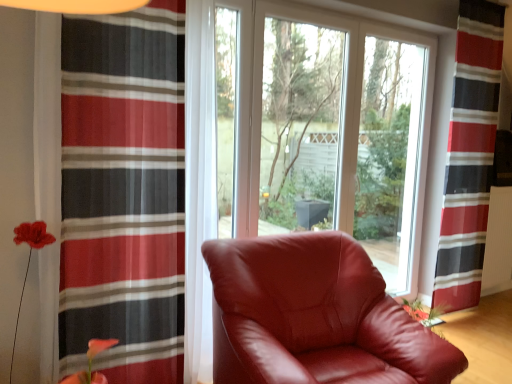
Question: Can you confirm if satin burgundy armchair at center is bigger than transparent glass window at center?

Choices:
 (A) no
 (B) yes

Answer: (B)

Question: From a real-world perspective, is satin burgundy armchair at center located beneath transparent glass window at center?

Choices:
 (A) no
 (B) yes

Answer: (B)

Question: Is satin burgundy armchair at center completely or partially outside of transparent glass window at center?

Choices:
 (A) yes
 (B) no

Answer: (A)

Question: Does satin burgundy armchair at center have a smaller size compared to transparent glass window at center?

Choices:
 (A) yes
 (B) no

Answer: (B)

Question: Can you confirm if satin burgundy armchair at center is positioned to the left of transparent glass window at center?

Choices:
 (A) no
 (B) yes

Answer: (B)

Question: Considering the relative positions of satin burgundy armchair at center and striped sheer curtain at left, which ranks as the first curtain in front-to-back order, in the image provided, is satin burgundy armchair at center to the left or to the right of striped sheer curtain at left, which ranks as the first curtain in front-to-back order,?

Choices:
 (A) left
 (B) right

Answer: (B)

Question: Is satin burgundy armchair at center wider or thinner than striped sheer curtain at left, placed as the 1th curtain when sorted from left to right?

Choices:
 (A) thin
 (B) wide

Answer: (B)

Question: Does point (229, 365) appear closer or farther from the camera than point (177, 331)?

Choices:
 (A) closer
 (B) farther

Answer: (A)

Question: From the image's perspective, relative to striped sheer curtain at left, acting as the second curtain starting from the right, is satin burgundy armchair at center above or below?

Choices:
 (A) below
 (B) above

Answer: (A)

Question: In the image, is white textured radiator at right on the left side or the right side of transparent glass window at center?

Choices:
 (A) left
 (B) right

Answer: (B)

Question: Is white textured radiator at right inside or outside of transparent glass window at center?

Choices:
 (A) outside
 (B) inside

Answer: (A)

Question: From the image's perspective, is white textured radiator at right located above or below transparent glass window at center?

Choices:
 (A) above
 (B) below

Answer: (B)

Question: Relative to transparent glass window at center, is white textured radiator at right in front or behind?

Choices:
 (A) behind
 (B) front

Answer: (A)

Question: Considering the positions of satin burgundy armchair at center and white textured radiator at right in the image, is satin burgundy armchair at center bigger or smaller than white textured radiator at right?

Choices:
 (A) big
 (B) small

Answer: (A)

Question: From their relative heights in the image, would you say satin burgundy armchair at center is taller or shorter than white textured radiator at right?

Choices:
 (A) tall
 (B) short

Answer: (B)